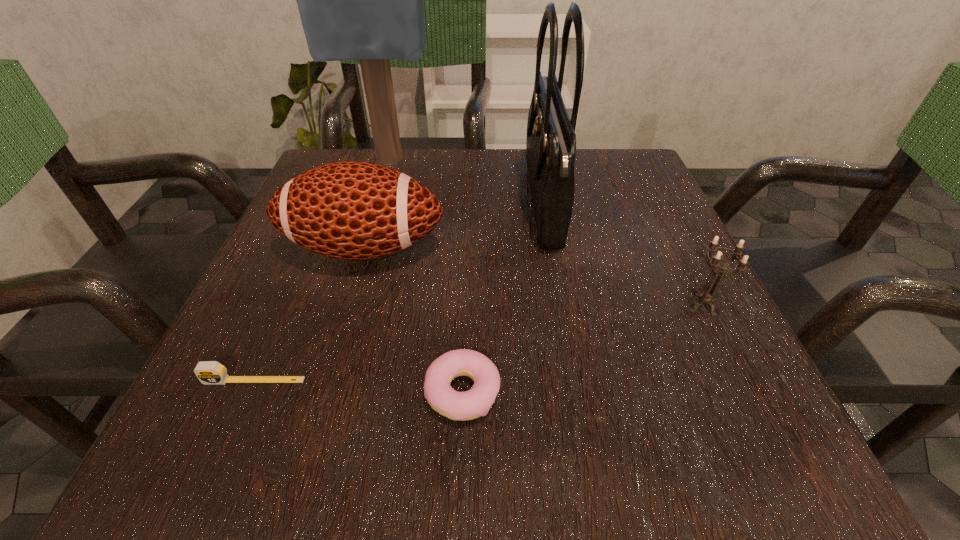
The image size is (960, 540). What are the coordinates of `mallet` in the screenshot? It's located at (363, 0).

I want to click on the second object from right to left, so click(551, 140).

Where is `the fourth shortest object`? The image size is (960, 540). the fourth shortest object is located at coordinates (352, 210).

The image size is (960, 540). I want to click on the rightmost object, so click(707, 298).

Identify the location of candle holder. This screenshot has height=540, width=960. (707, 298).

Locate an element on the screen. This screenshot has height=540, width=960. doughnut is located at coordinates (468, 405).

Image resolution: width=960 pixels, height=540 pixels. In order to click on tape measure in this screenshot , I will do coord(208,372).

The image size is (960, 540). What are the coordinates of `vacant space positioned 0.170m on the right of the mallet` in the screenshot? It's located at (506, 161).

Identify the location of free region located with an open clasp on the front of the fifth object from left to right. (502, 203).

At what (x,y) coordinates should I click in order to perform the action: click on vacant space located with an open clasp on the front of the fifth object from left to right. Please return your answer as a coordinate pair (x, y). The image size is (960, 540). Looking at the image, I should click on (488, 203).